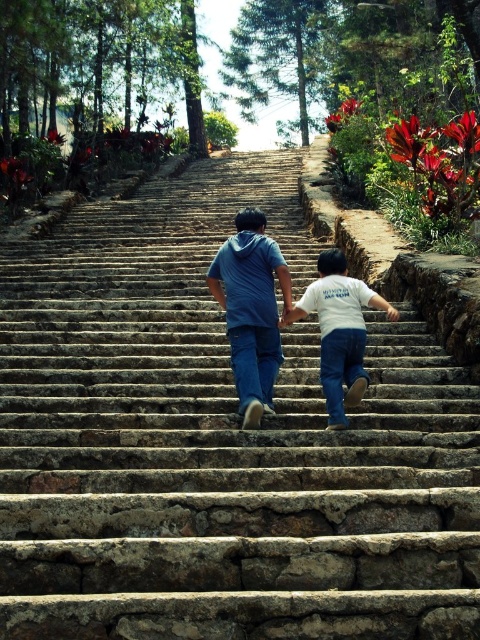
How much distance is there between blue denim jeans at center and white cotton shirt at center?

1.87 meters

Which is above, blue denim jeans at center or white cotton shirt at center?

Positioned higher is blue denim jeans at center.

The width and height of the screenshot is (480, 640). I want to click on blue denim jeans at center, so click(252, 310).

Is matte blue hoodie at center shorter than white cotton shirt at center?

Yes.

Can you confirm if matte blue hoodie at center is taller than white cotton shirt at center?

In fact, matte blue hoodie at center may be shorter than white cotton shirt at center.

Who is more distant from viewer, (x=239, y=264) or (x=348, y=381)?

The point (x=239, y=264) is more distant.

Locate an element on the screen. The height and width of the screenshot is (640, 480). matte blue hoodie at center is located at coordinates (251, 310).

Who is positioned more to the left, blue denim jeans at center or matte blue hoodie at center?

matte blue hoodie at center is more to the left.

Between point (289, 273) and point (242, 321), which one is positioned behind?

Point (289, 273)

Identify the location of blue denim jeans at center. This screenshot has height=640, width=480. (252, 310).